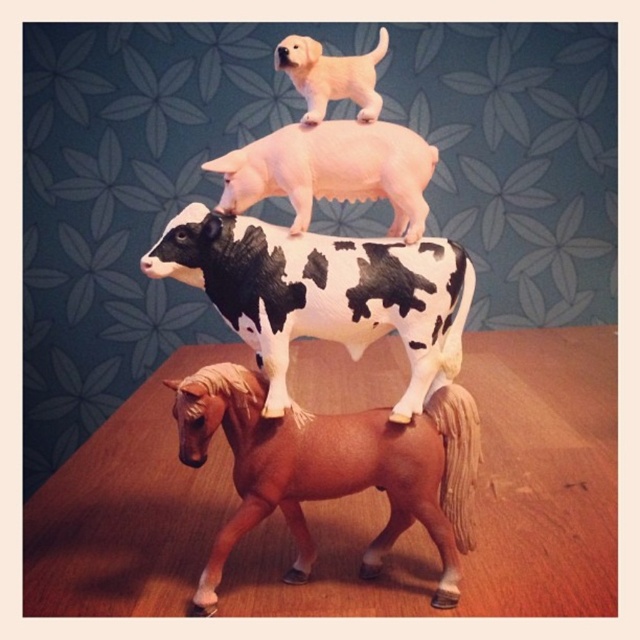
You are a child trying to add a new toy to the stack of animals. The new toy is a small, round ball that you want to place between the white matte pig at upper center and the light brown matte pony at upper center. Can you fit the ball there based on their sizes?

The white matte pig at upper center is larger than the light brown matte pony at upper center. Since the ball is small and round, it might fit between them if there is enough space between the two animals. However, the exact placement depends on the available space between the pig and pony, which isn

You are a child playing with these toy animals and want to place a new toy sheep between the black and white spotted cow at center and the white matte pig at upper center. Based on their positions, where should you place the sheep?

The black and white spotted cow at center is to the left of the white matte pig at upper center, so you should place the sheep between them on the right side of the cow and the left side of the pig.

Based on the photo, you are looking at the image of stacked toy animals. There are two points marked in the scene. The first point is at coordinates point (420,460) and the second is at point (221,168). Which point is closer to you?

Point (420,460) is closer to the camera than point (221,168).